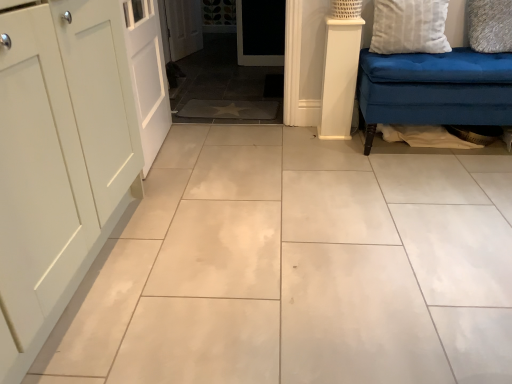
What are the coordinates of `blank space situated above white smooth column at right (from a real-world perspective)` in the screenshot? It's located at (345, 11).